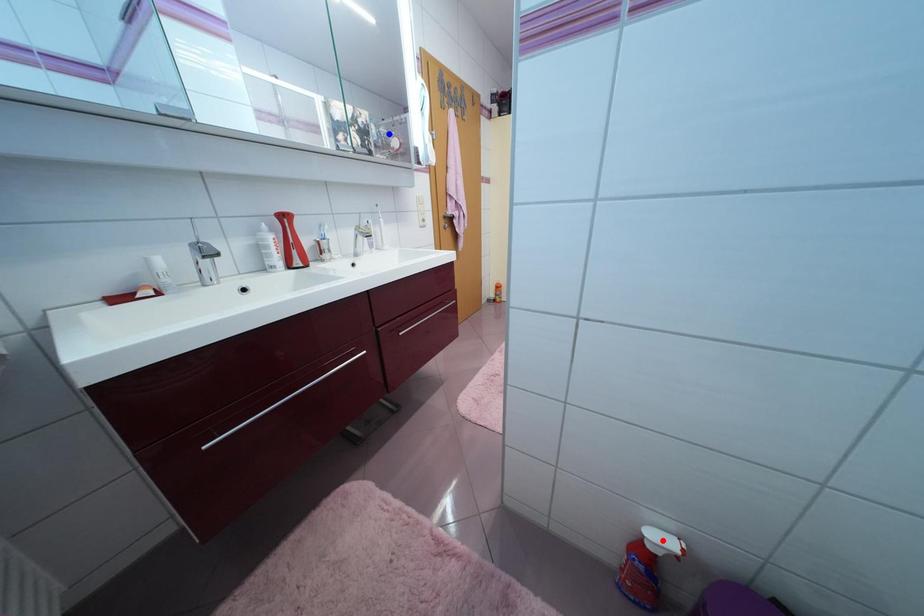
Question: Two points are marked on the image. Which point is closer to the camera?

Choices:
 (A) Blue point is closer.
 (B) Red point is closer.

Answer: (B)